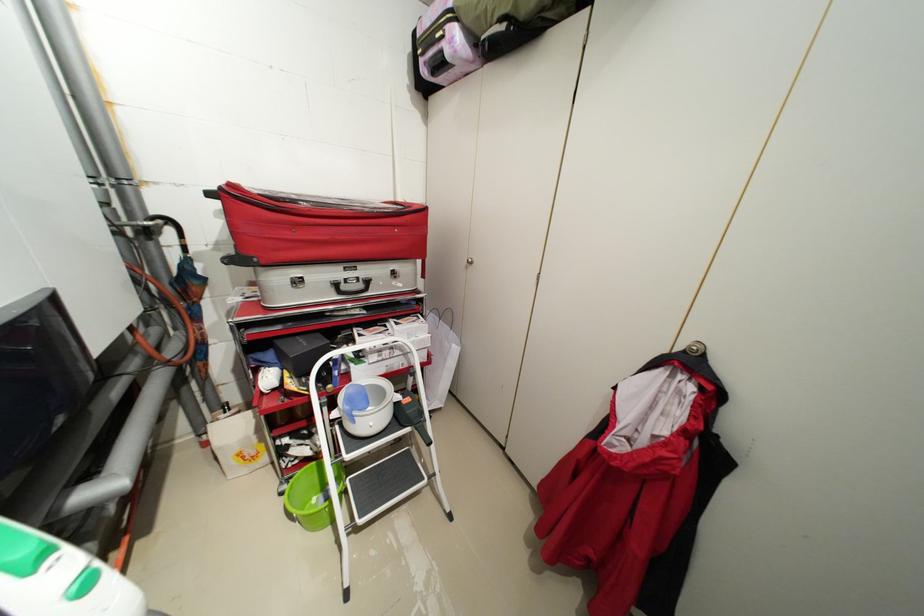
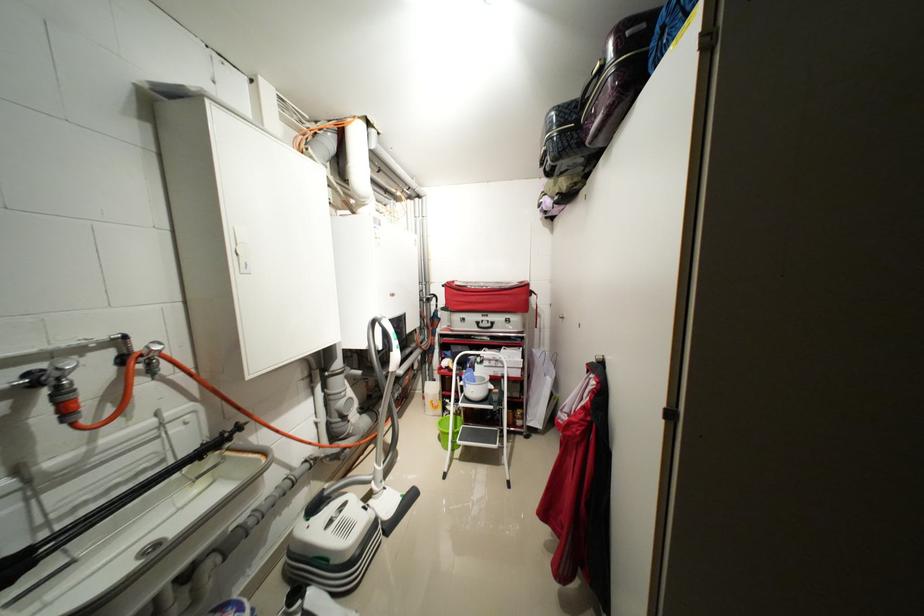
Locate, in the second image, the point that corresponds to (368,286) in the first image.

(496, 326)